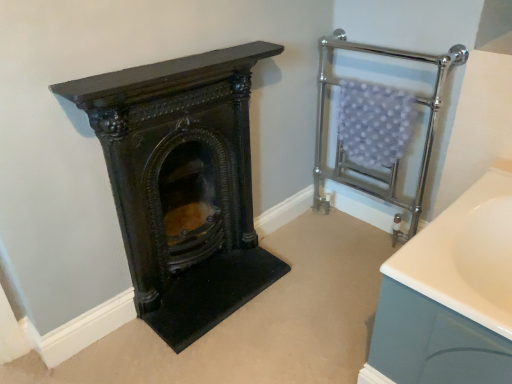
Question: From a real-world perspective, is dark brown wood at left physically above chrome metallic towel rack at upper right?

Choices:
 (A) no
 (B) yes

Answer: (A)

Question: Is dark brown wood at left surrounding chrome metallic towel rack at upper right?

Choices:
 (A) yes
 (B) no

Answer: (B)

Question: Can you confirm if dark brown wood at left is thinner than chrome metallic towel rack at upper right?

Choices:
 (A) no
 (B) yes

Answer: (B)

Question: Does dark brown wood at left have a larger size compared to chrome metallic towel rack at upper right?

Choices:
 (A) yes
 (B) no

Answer: (B)

Question: Can we say dark brown wood at left lies outside chrome metallic towel rack at upper right?

Choices:
 (A) yes
 (B) no

Answer: (A)

Question: From the image's perspective, would you say dark brown wood at left is positioned over chrome metallic towel rack at upper right?

Choices:
 (A) no
 (B) yes

Answer: (A)

Question: Is chrome metallic towel rack at upper right to the left of dark brown wood at left from the viewer's perspective?

Choices:
 (A) no
 (B) yes

Answer: (A)

Question: Does chrome metallic towel rack at upper right have a lesser height compared to dark brown wood at left?

Choices:
 (A) yes
 (B) no

Answer: (B)

Question: Is chrome metallic towel rack at upper right completely or partially outside of dark brown wood at left?

Choices:
 (A) no
 (B) yes

Answer: (B)

Question: From a real-world perspective, does chrome metallic towel rack at upper right stand above dark brown wood at left?

Choices:
 (A) no
 (B) yes

Answer: (B)

Question: Is chrome metallic towel rack at upper right thinner than dark brown wood at left?

Choices:
 (A) yes
 (B) no

Answer: (B)

Question: Could you tell me if chrome metallic towel rack at upper right is facing dark brown wood at left?

Choices:
 (A) no
 (B) yes

Answer: (B)

Question: Is dark brown wood at left in front of or behind chrome metallic towel rack at upper right in the image?

Choices:
 (A) front
 (B) behind

Answer: (A)